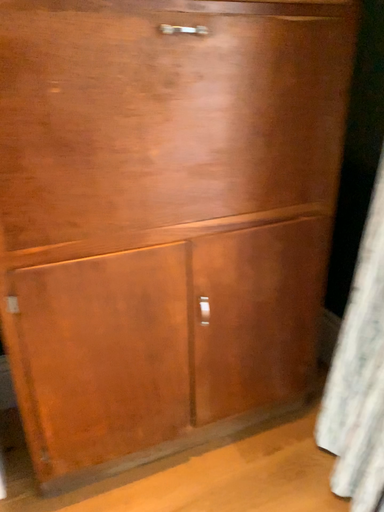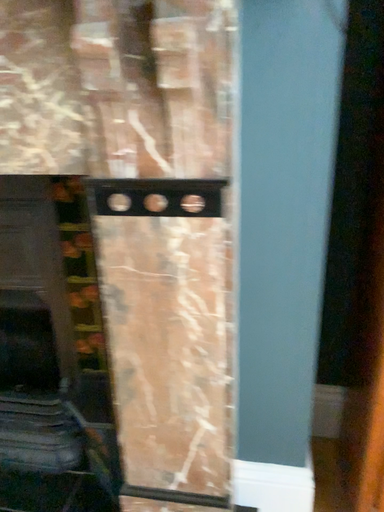
Question: How did the camera likely rotate when shooting the video?

Choices:
 (A) rotated upward
 (B) rotated downward

Answer: (A)